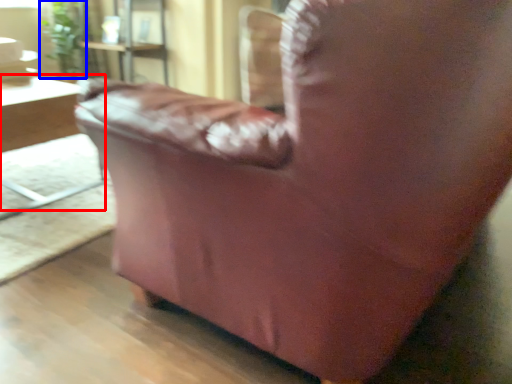
Question: Which object is further to the camera taking this photo, table (highlighted by a red box) or plant (highlighted by a blue box)?

Choices:
 (A) table
 (B) plant

Answer: (B)